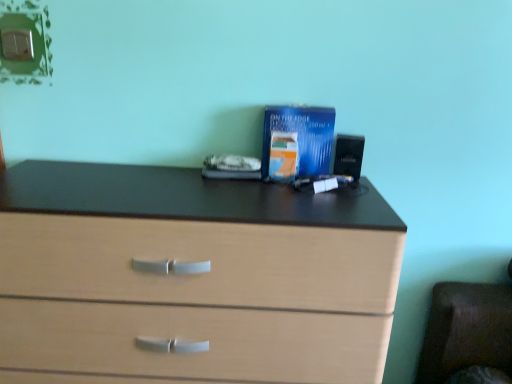
You are a GUI agent. You are given a task and a screenshot of the screen. Output one action in this format:
    pyautogui.click(x=<x>, y=<y>)
    Task: Click on the space that is in front of blue glossy paperback book at center, which is the 2th paperback book from back to front
    
    Given the screenshot: What is the action you would take?
    pyautogui.click(x=285, y=201)